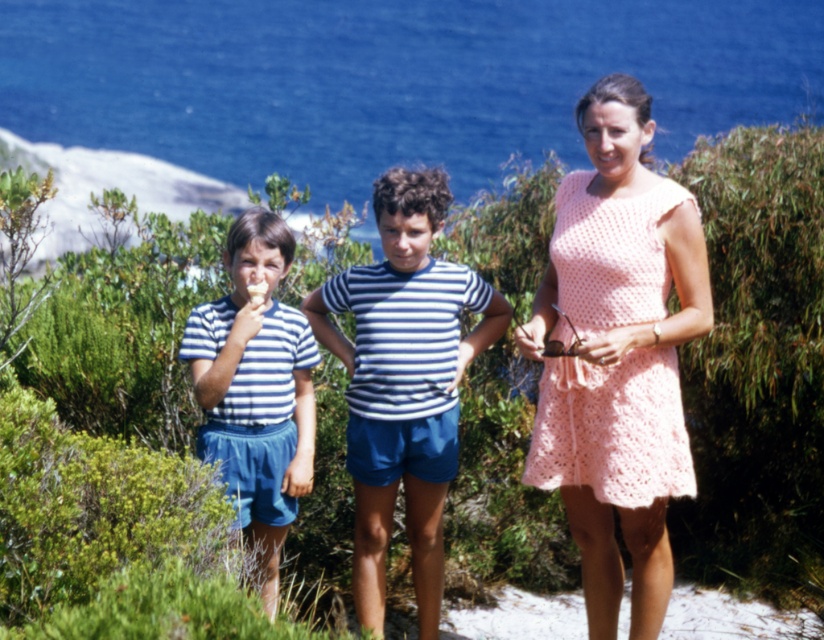
You are standing at the origin point in the scene. Which object is located at the coordinates point (405, 381)?

The point (405, 381) marks the location of the blue striped shirt at center.